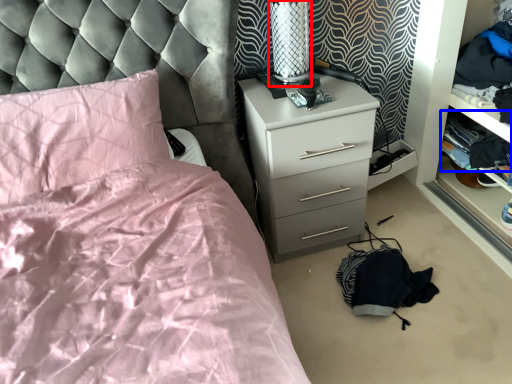
Question: Which object appears farthest to the camera in this image, table lamp (highlighted by a red box) or clothing (highlighted by a blue box)?

Choices:
 (A) table lamp
 (B) clothing

Answer: (B)